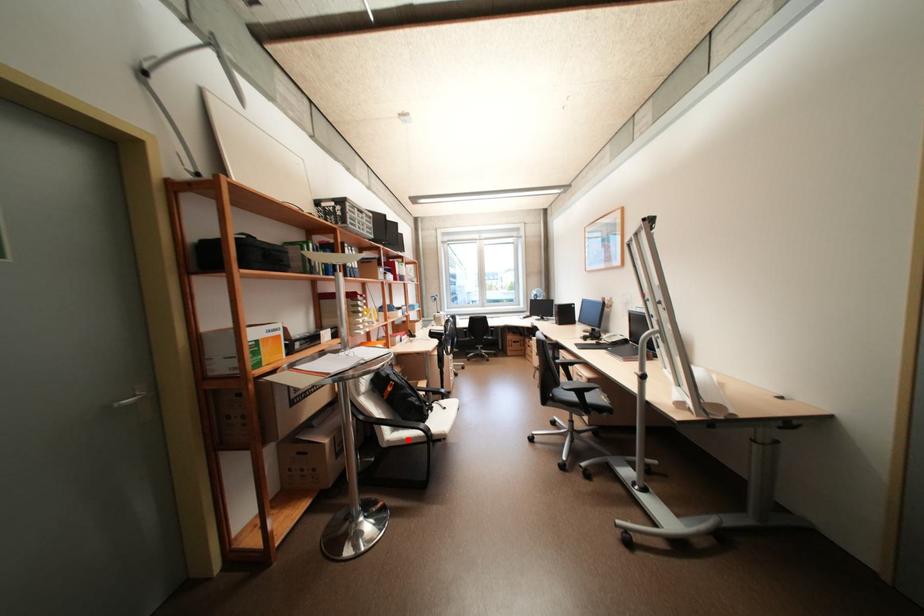
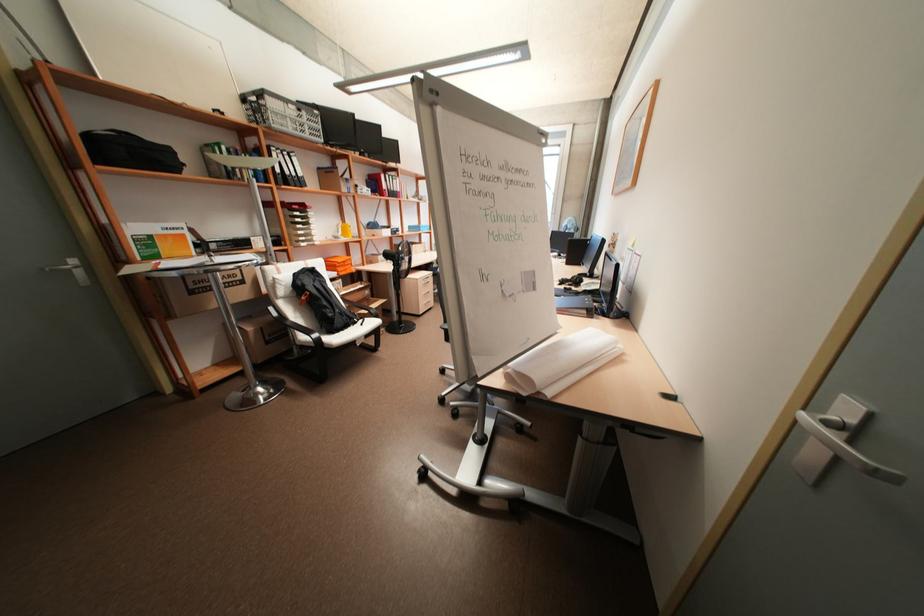
Question: I am providing you with two images of the same scene from different viewpoints. A red point is shown in image1. For the corresponding object point in image2, is it positioned nearer or farther from the camera?

Choices:
 (A) Nearer
 (B) Farther

Answer: (A)